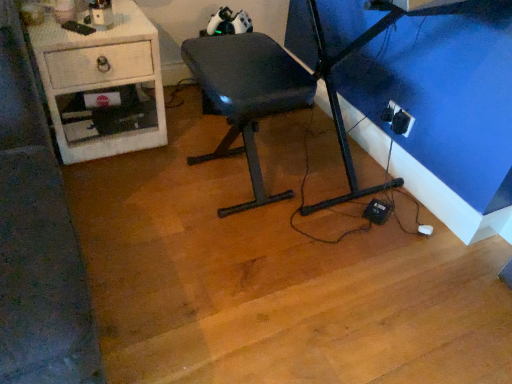
The image size is (512, 384). Describe the element at coordinates (397, 119) in the screenshot. I see `black plastic outlet at lower right` at that location.

The width and height of the screenshot is (512, 384). In order to click on matte black chair at center in this screenshot , I will do `click(247, 95)`.

Image resolution: width=512 pixels, height=384 pixels. I want to click on white glossy desk at left, so click(x=102, y=85).

How distant is black plastic outlet at lower right from white glossy desk at left?

A distance of 3.71 feet exists between black plastic outlet at lower right and white glossy desk at left.

Between black plastic outlet at lower right and white glossy desk at left, which one has smaller size?

black plastic outlet at lower right is smaller.

Which object is further away from the camera, black plastic outlet at lower right or white glossy desk at left?

black plastic outlet at lower right is further away from the camera.

From the image's perspective, who appears lower, black plastic outlet at lower right or white glossy desk at left?

black plastic outlet at lower right is shown below in the image.

Is white glossy desk at left surrounded by matte black chair at center?

Result: Definitely not — white glossy desk at left is not inside matte black chair at center.

How many degrees apart are the facing directions of matte black chair at center and white glossy desk at left?

90.7 degrees.

Is matte black chair at center wider than white glossy desk at left?

No.

From the image's perspective, is black plastic outlet at lower right positioned above or below matte black chair at center?

black plastic outlet at lower right is above matte black chair at center.

From a real-world perspective, between black plastic outlet at lower right and matte black chair at center, who is vertically lower?

black plastic outlet at lower right.

Is black plastic outlet at lower right shorter than matte black chair at center?

Yes.

In order to click on electric outlet on the right of matte black chair at center in this screenshot , I will do `click(397, 119)`.

Is matte black chair at center oriented towards black plastic outlet at lower right?

No.

Between matte black chair at center and black plastic outlet at lower right, which one has smaller width?

Thinner between the two is black plastic outlet at lower right.

From the picture: Considering the relative positions of matte black chair at center and black plastic outlet at lower right in the image provided, is matte black chair at center to the left of black plastic outlet at lower right from the viewer's perspective?

Correct, you'll find matte black chair at center to the left of black plastic outlet at lower right.

From the image's perspective, between white glossy desk at left and matte black chair at center, which one is located above?

white glossy desk at left appears higher in the image.

Looking at this image, does white glossy desk at left have a lesser height compared to matte black chair at center?

Yes, white glossy desk at left is shorter than matte black chair at center.

Does white glossy desk at left turn towards matte black chair at center?

No, white glossy desk at left does not turn towards matte black chair at center.

This screenshot has width=512, height=384. I want to click on electric outlet lying below the white glossy desk at left (from the image's perspective), so click(397, 119).

From the image's perspective, is white glossy desk at left above or below black plastic outlet at lower right?

Clearly, from the image's perspective, white glossy desk at left is above black plastic outlet at lower right.

From the picture: Measure the distance from white glossy desk at left to black plastic outlet at lower right.

3.71 feet.

Does point (132, 135) lie in front of point (387, 118)?

Yes, point (132, 135) is in front of point (387, 118).

The height and width of the screenshot is (384, 512). What are the coordinates of `electric outlet on the right of white glossy desk at left` in the screenshot? It's located at (397, 119).

The width and height of the screenshot is (512, 384). In order to click on desk behind the matte black chair at center in this screenshot , I will do `click(102, 85)`.

Based on their spatial positions, is white glossy desk at left or black plastic outlet at lower right further from matte black chair at center?

Based on the image, black plastic outlet at lower right appears to be further to matte black chair at center.

Estimate the real-world distances between objects in this image. Which object is closer to white glossy desk at left, matte black chair at center or black plastic outlet at lower right?

Based on the image, matte black chair at center appears to be nearer to white glossy desk at left.

Looking at the image, which one is located further to white glossy desk at left, black plastic outlet at lower right or matte black chair at center?

Among the two, black plastic outlet at lower right is located further to white glossy desk at left.

Looking at the image, which one is located closer to black plastic outlet at lower right, matte black chair at center or white glossy desk at left?

matte black chair at center is positioned closer to the anchor black plastic outlet at lower right.

Considering their positions, is white glossy desk at left positioned further to black plastic outlet at lower right than matte black chair at center?

white glossy desk at left is positioned further to the anchor black plastic outlet at lower right.

Looking at the image, which one is located further to matte black chair at center, black plastic outlet at lower right or white glossy desk at left?

Based on the image, black plastic outlet at lower right appears to be further to matte black chair at center.

Find the location of `furniture located between white glossy desk at left and black plastic outlet at lower right in the left-right direction`. furniture located between white glossy desk at left and black plastic outlet at lower right in the left-right direction is located at coordinates (247, 95).